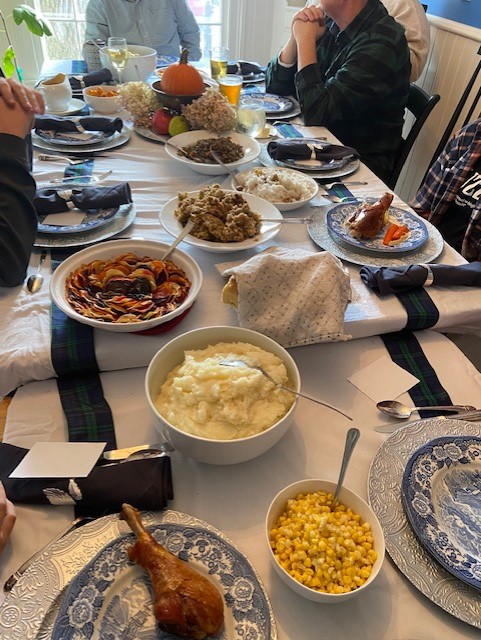
At what (x,y) coordinates should I click in order to perform the action: click on top small plate with no food closest. Please return your answer as a coordinate pair (x, y). Looking at the image, I should click on (451, 513).